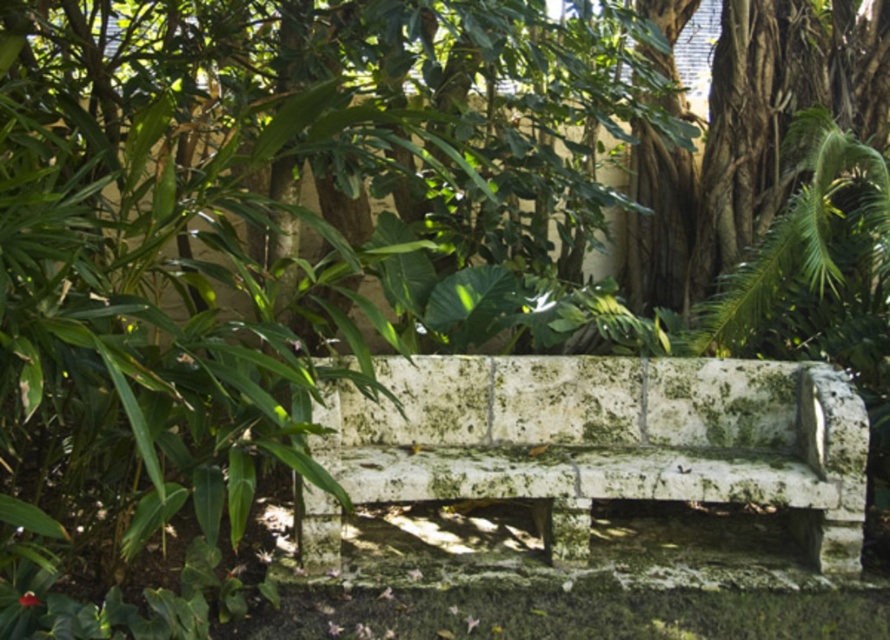
You are standing at the camera position and want to place a small potted plant exactly 10 feet away from the mossy stone bench at center. Can you place it within 0.5 feet accuracy?

The mossy stone bench at center is 10.26 feet away from the camera. To place the potted plant 10 feet away from the bench, you would need to position it 0.26 feet closer to the camera than your current position. Since the required accuracy is within 0.5 feet, this is achievable.

You are standing in the outdoor area and want to sit on the mossy stone bench at center. However, there is another green mossy stone bench at upper center in your way. Which bench should you move closer to first to reach your desired seat?

You should move closer to the mossy stone bench at center first because it is closer to you than the green mossy stone bench at upper center, so you can reach it without needing to go around the farther one.

You are a gardener planning to place a new flowerpot between the mossy stone bench at center and the green mossy stone bench at upper center. Which bench should the flowerpot be closer to if you want it to be at a lower elevation?

The mossy stone bench at center has a lesser height compared to the green mossy stone bench at upper center. Therefore, placing the flowerpot closer to the mossy stone bench at center would ensure it is at a lower elevation.